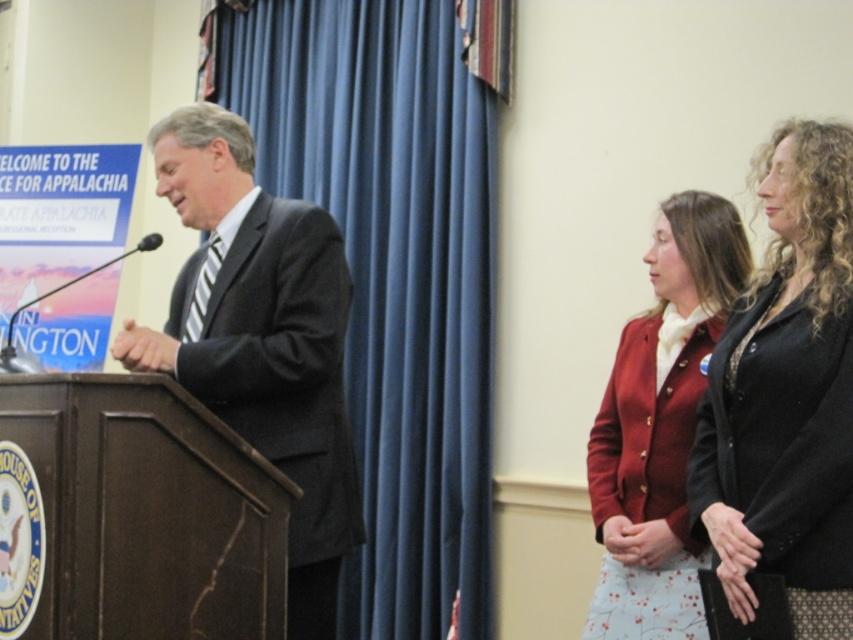
Question: Considering the relative positions of blue fabric curtain at center and matte red blazer at center in the image provided, where is blue fabric curtain at center located with respect to matte red blazer at center?

Choices:
 (A) below
 (B) above

Answer: (B)

Question: Which is farther from the matte red blazer at center?

Choices:
 (A) blue fabric curtain at center
 (B) black matte blazer at right

Answer: (A)

Question: Is dark gray suit at center behind matte red blazer at center?

Choices:
 (A) yes
 (B) no

Answer: (B)

Question: Is blue fabric curtain at center behind dark gray suit at center?

Choices:
 (A) no
 (B) yes

Answer: (B)

Question: Which object is closer to the camera taking this photo?

Choices:
 (A) blue fabric curtain at center
 (B) black matte blazer at right

Answer: (B)

Question: Among these points, which one is nearest to the camera?

Choices:
 (A) (782, 499)
 (B) (250, 156)
 (C) (434, 458)

Answer: (A)